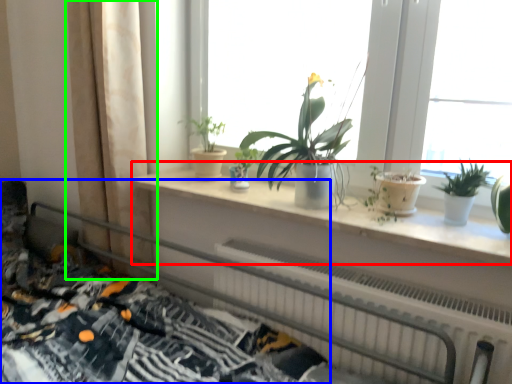
Question: Estimate the real-world distances between objects in this image. Which object is farther from window sill (highlighted by a red box), bed (highlighted by a blue box) or curtain (highlighted by a green box)?

Choices:
 (A) bed
 (B) curtain

Answer: (A)